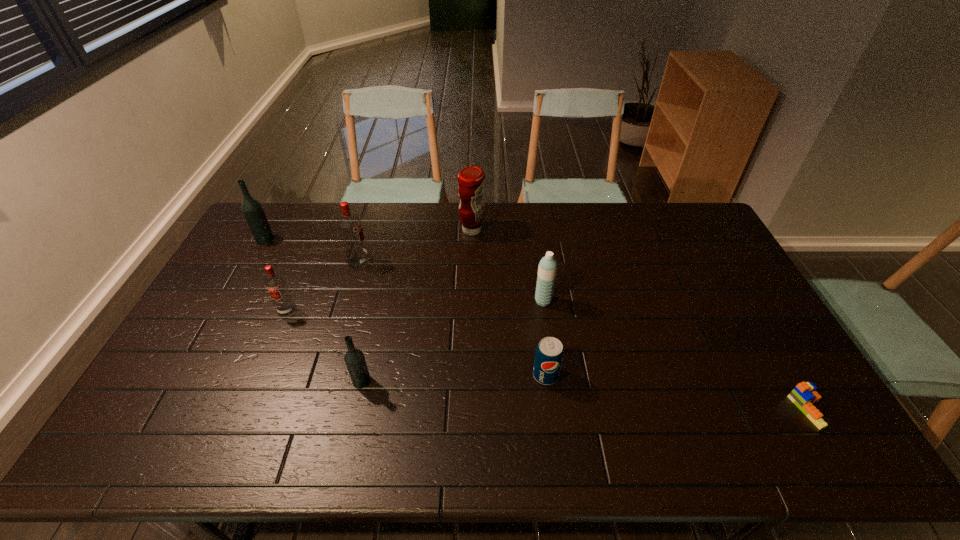
Find the location of a particular element. The width and height of the screenshot is (960, 540). vacant space that satisfies the following two spatial constraints: 1. on the front side of the fifth object from left to right; 2. on the front label of the second vodka from right to left is located at coordinates (471, 262).